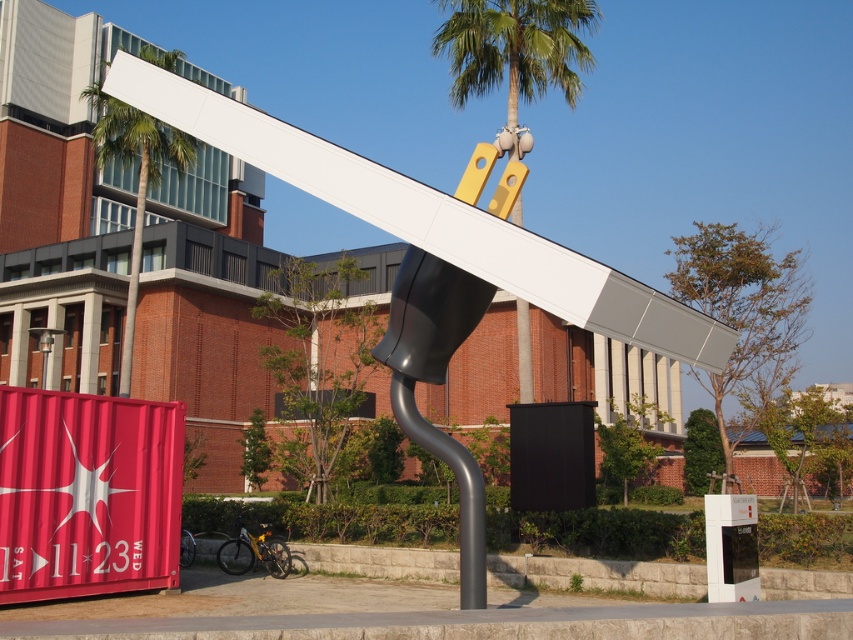
Which is more to the left, green leafy palm tree at upper center or green leafy palm tree at upper left?

From the viewer's perspective, green leafy palm tree at upper left appears more on the left side.

Does green leafy palm tree at upper center have a smaller size compared to green leafy palm tree at upper left?

Actually, green leafy palm tree at upper center might be larger than green leafy palm tree at upper left.

What do you see at coordinates (515, 52) in the screenshot? I see `green leafy palm tree at upper center` at bounding box center [515, 52].

Image resolution: width=853 pixels, height=640 pixels. I want to click on green leafy palm tree at upper center, so click(515, 52).